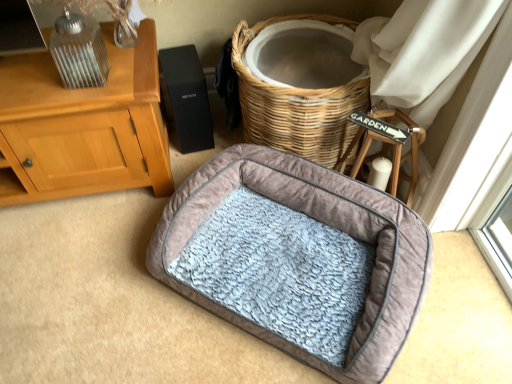
Question: Looking at the image, does velvet-like gray dog bed at center seem bigger or smaller compared to woven wicker basket at center?

Choices:
 (A) big
 (B) small

Answer: (B)

Question: Is velvet-like gray dog bed at center in front of or behind woven wicker basket at center in the image?

Choices:
 (A) behind
 (B) front

Answer: (B)

Question: From the image's perspective, is velvet-like gray dog bed at center located above or below woven wicker basket at center?

Choices:
 (A) above
 (B) below

Answer: (B)

Question: Is point (298, 135) closer or farther from the camera than point (322, 226)?

Choices:
 (A) closer
 (B) farther

Answer: (B)

Question: Is woven wicker basket at center wider or thinner than velvet-like gray dog bed at center?

Choices:
 (A) thin
 (B) wide

Answer: (A)

Question: Looking at the image, does woven wicker basket at center seem bigger or smaller compared to velvet-like gray dog bed at center?

Choices:
 (A) small
 (B) big

Answer: (B)

Question: From a real-world perspective, is woven wicker basket at center above or below velvet-like gray dog bed at center?

Choices:
 (A) below
 (B) above

Answer: (B)